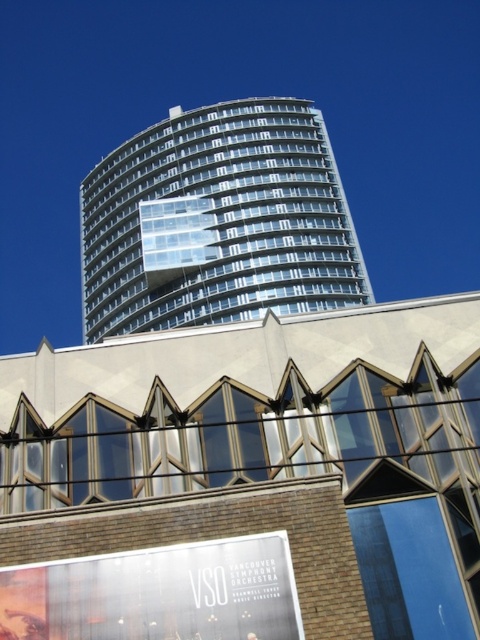
Question: Does transparent glass building at upper center have a greater width compared to white glossy billboard at lower center?

Choices:
 (A) no
 (B) yes

Answer: (B)

Question: Does transparent glass building at upper center have a larger size compared to white glossy billboard at lower center?

Choices:
 (A) yes
 (B) no

Answer: (A)

Question: Which point appears closest to the camera in this image?

Choices:
 (A) (300, 300)
 (B) (286, 566)

Answer: (B)

Question: Which point is closer to the camera?

Choices:
 (A) white glossy billboard at lower center
 (B) transparent glass building at upper center

Answer: (A)

Question: Is transparent glass building at upper center below white glossy billboard at lower center?

Choices:
 (A) no
 (B) yes

Answer: (A)